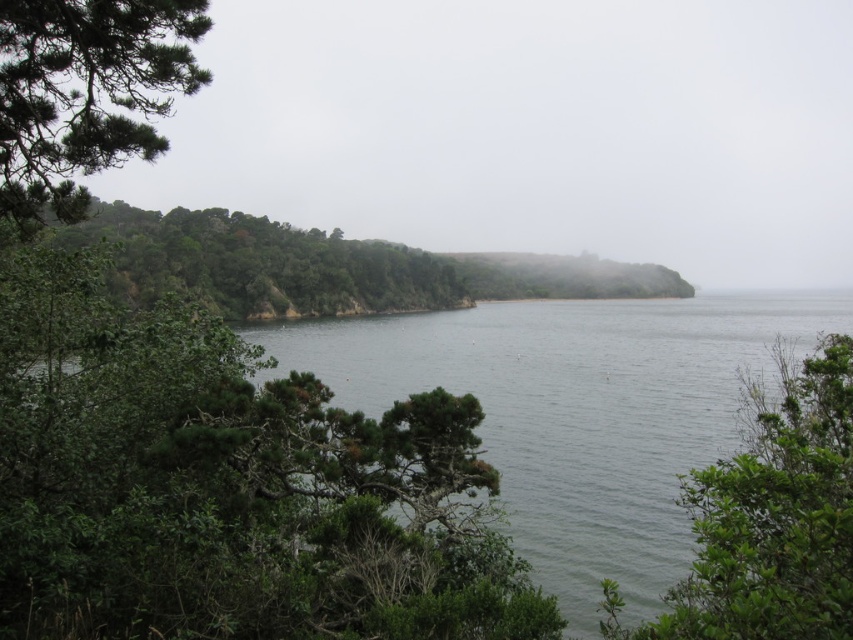
Question: Does green leafy tree at lower right appear under green matte tree at upper left?

Choices:
 (A) yes
 (B) no

Answer: (A)

Question: Is green matte tree at upper left to the left of green leafy trees at left from the viewer's perspective?

Choices:
 (A) no
 (B) yes

Answer: (A)

Question: Among these objects, which one is nearest to the camera?

Choices:
 (A) green leafy tree at lower right
 (B) green leafy trees at left

Answer: (A)

Question: Which object is the closest to the green matte tree at upper left?

Choices:
 (A) green leafy tree at center-left
 (B) green leafy trees at left

Answer: (A)

Question: Can you confirm if green matte tree at upper left is positioned to the left of green leafy trees at left?

Choices:
 (A) yes
 (B) no

Answer: (B)

Question: Which of these objects is positioned farthest from the green leafy tree at lower right?

Choices:
 (A) green leafy trees at left
 (B) green matte tree at upper left

Answer: (A)